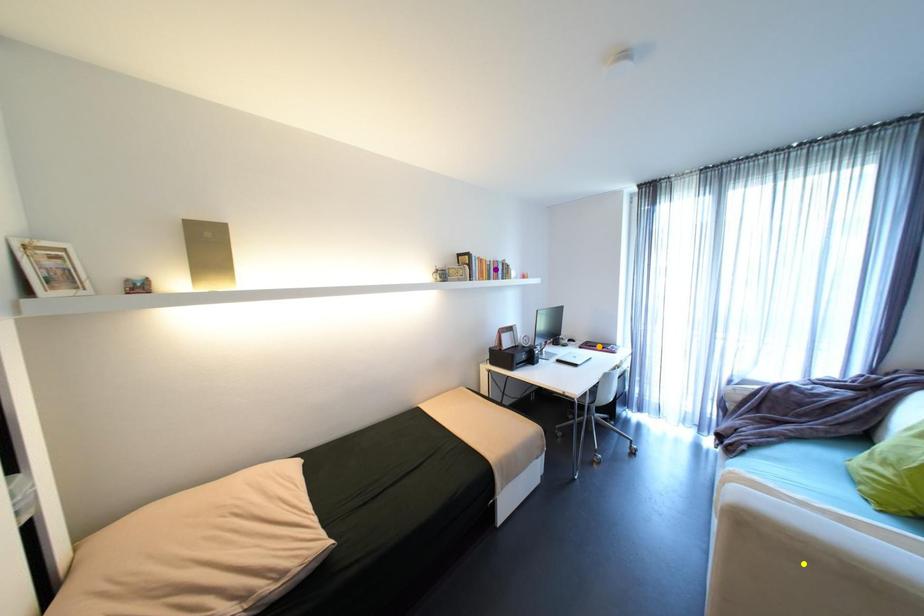
Order these from nearest to farthest:
purple point, orange point, yellow point

orange point
purple point
yellow point